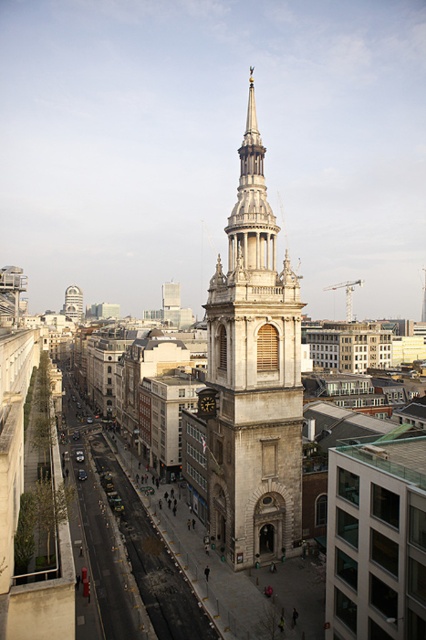
Question: Which point appears closest to the camera in this image?

Choices:
 (A) (69, 308)
 (B) (293, 344)

Answer: (B)

Question: Is stone tower at center bigger than stone clock tower at center?

Choices:
 (A) yes
 (B) no

Answer: (A)

Question: Does stone tower at center appear over stone clock tower at center?

Choices:
 (A) yes
 (B) no

Answer: (B)

Question: Which of the following is the closest to the observer?

Choices:
 (A) (80, 298)
 (B) (294, 300)

Answer: (B)

Question: Where is stone tower at center located in relation to stone clock tower at center in the image?

Choices:
 (A) right
 (B) left

Answer: (A)